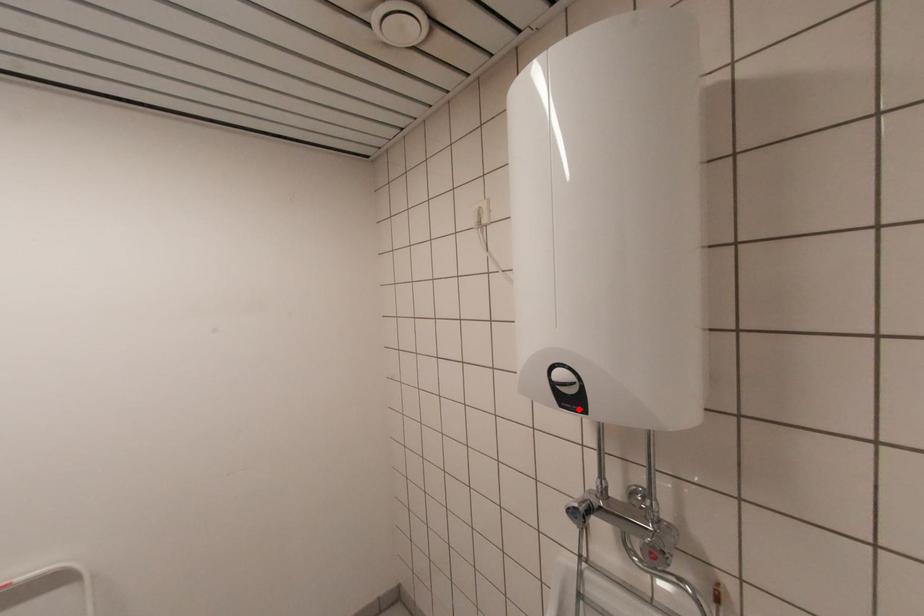
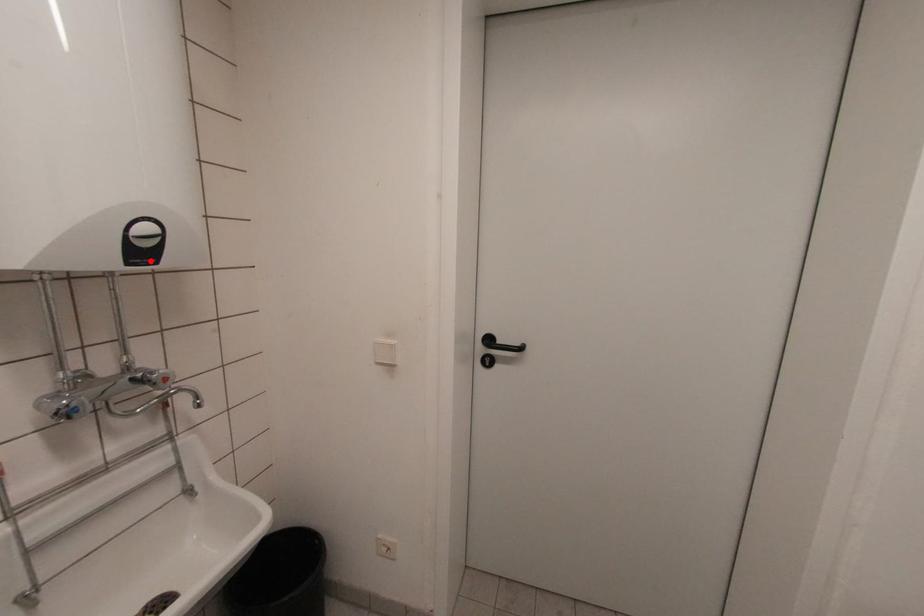
I am providing you with two images of the same scene from different viewpoints. A red point is marked on the first image and another point is marked on the second image. Does the point marked in image1 correspond to the same location as the one in image2?

Yes